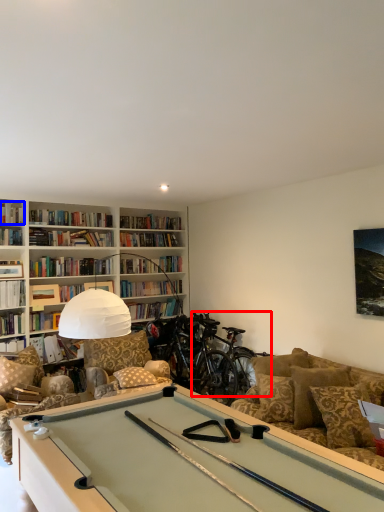
Question: Which point is closer to the camera, mountain bike (highlighted by a red box) or book (highlighted by a blue box)?

Choices:
 (A) mountain bike
 (B) book

Answer: (A)